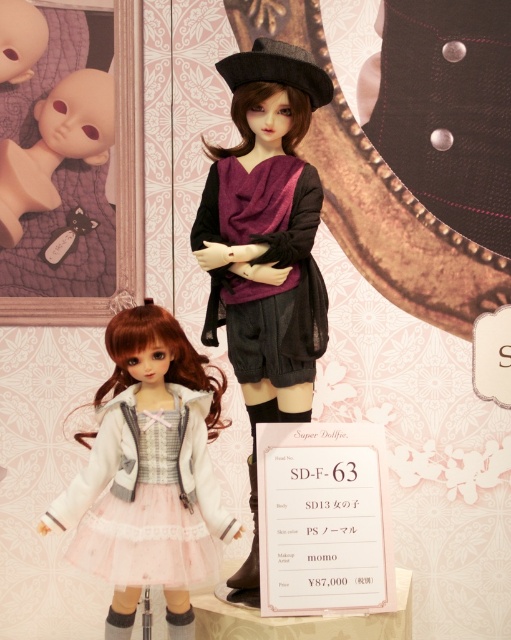
What do you see at coordinates (266, 262) in the screenshot? I see `purple sheer scarf at center` at bounding box center [266, 262].

Which is in front, point (282, 204) or point (26, 157)?

Point (282, 204) is in front.

Does point (243, 378) come in front of point (36, 205)?

Yes, it is in front of point (36, 205).

This screenshot has width=511, height=640. In order to click on purple sheer scarf at center in this screenshot , I will do tap(266, 262).

Between matte black doll at center and matte black doll at upper left, which one is positioned higher?

matte black doll at upper left is above.

Can you confirm if matte black doll at center is positioned below matte black doll at upper left?

Indeed, matte black doll at center is positioned under matte black doll at upper left.

Is point (243, 566) farther from viewer compared to point (4, 189)?

No, (243, 566) is in front of (4, 189).

This screenshot has height=640, width=511. In order to click on matte black doll at center in this screenshot , I will do `click(265, 248)`.

Can you confirm if pale pink tulle dress at lower left is thinner than matte black doll at upper left?

Incorrect, pale pink tulle dress at lower left's width is not less than matte black doll at upper left's.

Which is more to the right, pale pink tulle dress at lower left or matte black doll at upper left?

pale pink tulle dress at lower left

Who is more forward, (136, 508) or (67, 109)?

Point (136, 508) is in front.

The image size is (511, 640). Identify the location of pale pink tulle dress at lower left. (147, 499).